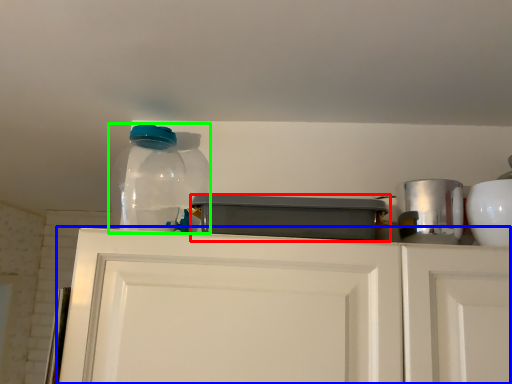
Question: Which object is the farthest from appliance (highlighted by a red box)? Choose among these: cabinetry (highlighted by a blue box) or bottle (highlighted by a green box).

Choices:
 (A) cabinetry
 (B) bottle

Answer: (B)